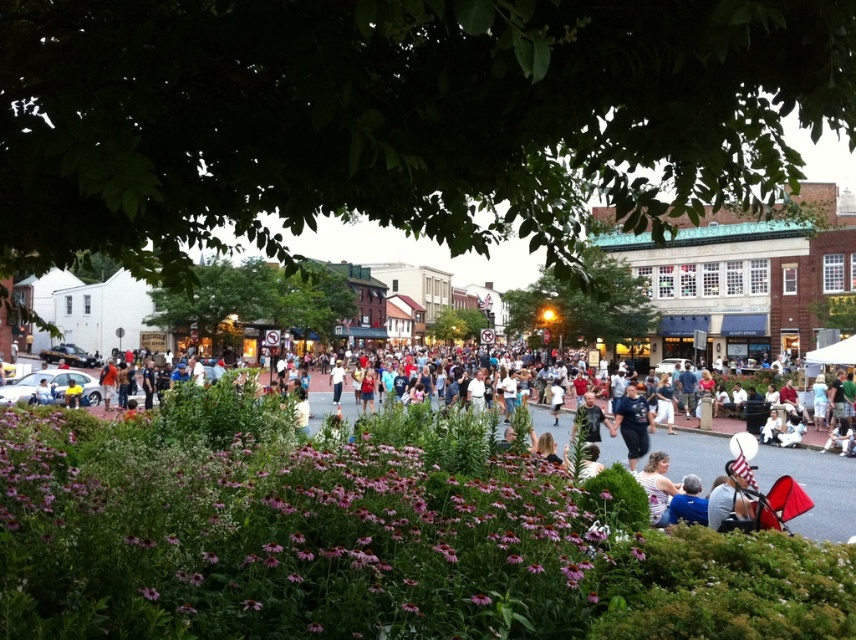
Looking at this image, you are standing in the town square and see a person with light brown hair at lower center and a blue fabric at lower right. Which object is nearer to you?

The light brown hair at lower center is closer to the viewer than the blue fabric at lower right.

You are standing in the town square and want to take a photo of the purple matte flowers at center. Based on their position, where should you aim your camera to capture them in the frame?

To capture the purple matte flowers at center in your photo, aim your camera at the coordinates point (286, 540), which is their exact 2D location in the scene.